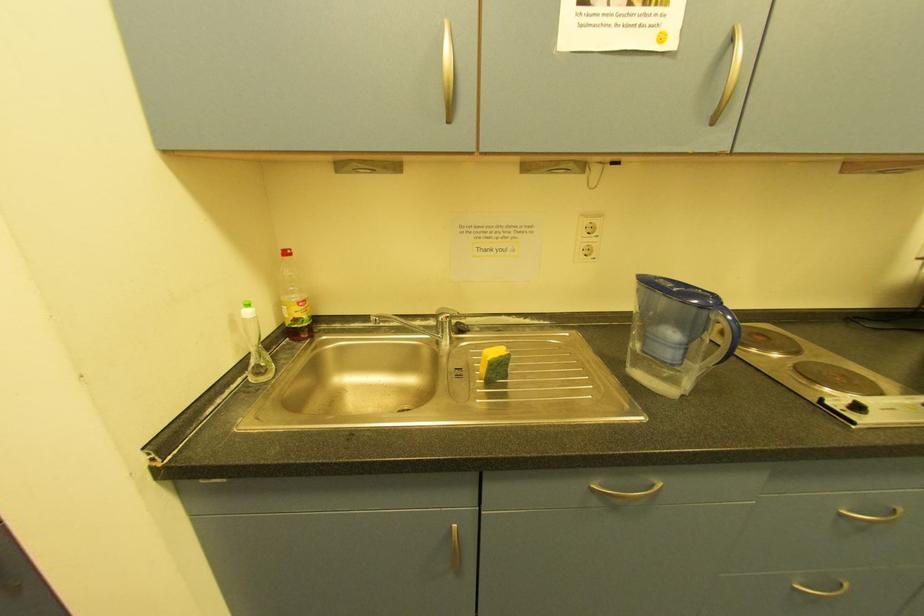
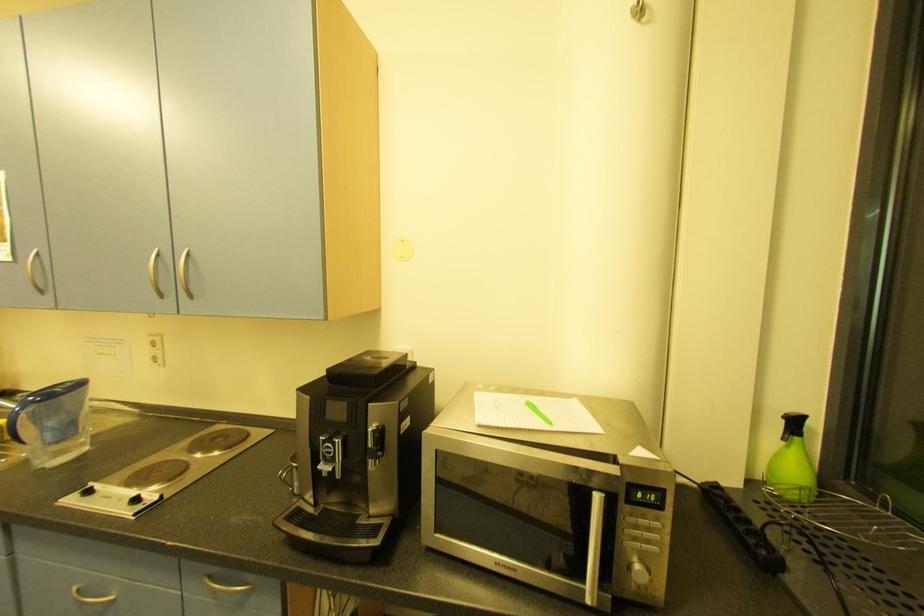
Question: In a continuous first-person perspective shot, in which direction is the camera moving?

Choices:
 (A) Left
 (B) Right
 (C) Forward
 (D) Backward

Answer: (B)